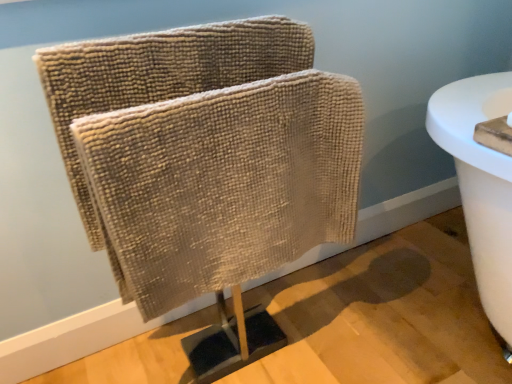
The width and height of the screenshot is (512, 384). I want to click on free region under beige textured towel at center (from a real-world perspective), so click(x=248, y=332).